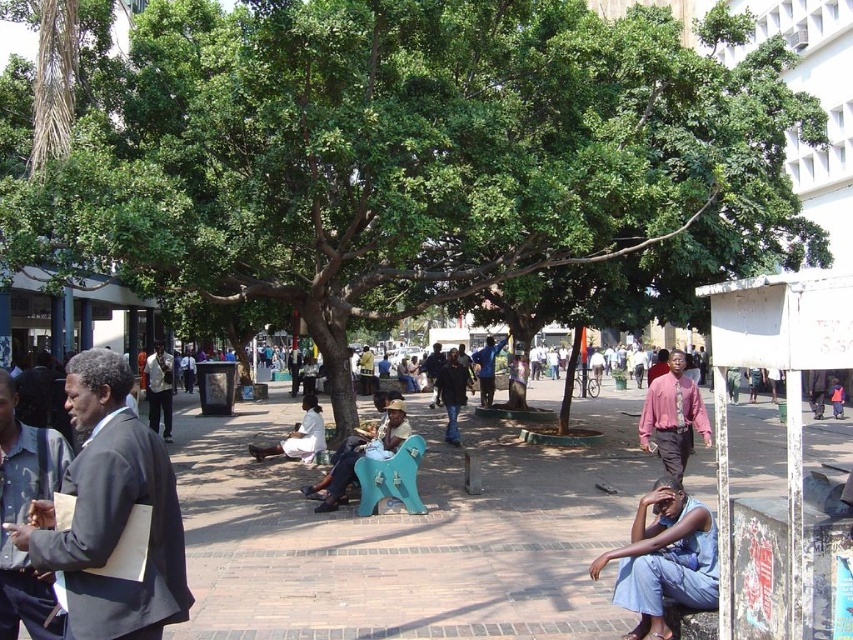
Who is positioned more to the right, dark brown leather jacket at left or pink shirt at center?

pink shirt at center

Does dark brown leather jacket at left appear over pink shirt at center?

Indeed, dark brown leather jacket at left is positioned over pink shirt at center.

The width and height of the screenshot is (853, 640). What are the coordinates of `dark brown leather jacket at left` in the screenshot? It's located at (25, 516).

Is point (248, 506) less distant than point (397, 400)?

Yes.

Is brick pavement at center wider than wooden bench at center?

Yes.

What are the coordinates of `brick pavement at center` in the screenshot? It's located at (405, 532).

Can you confirm if dark gray suit at left is shorter than matte black suit at left?

Yes, dark gray suit at left is shorter than matte black suit at left.

Can you confirm if dark gray suit at left is bigger than matte black suit at left?

No.

Does point (167, 557) come farther from viewer compared to point (149, 387)?

No, (167, 557) is closer to viewer.

In order to click on dark gray suit at left in this screenshot , I will do `click(109, 513)`.